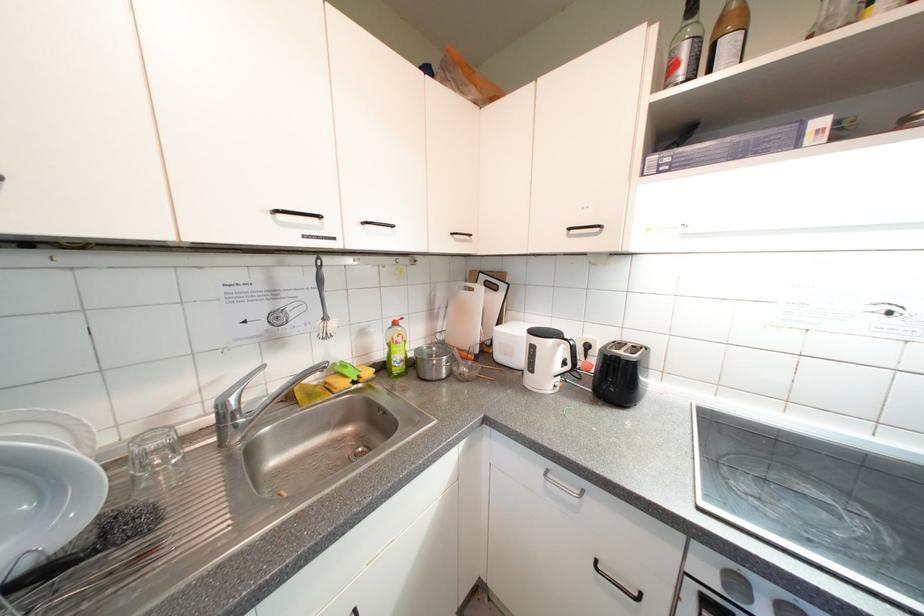
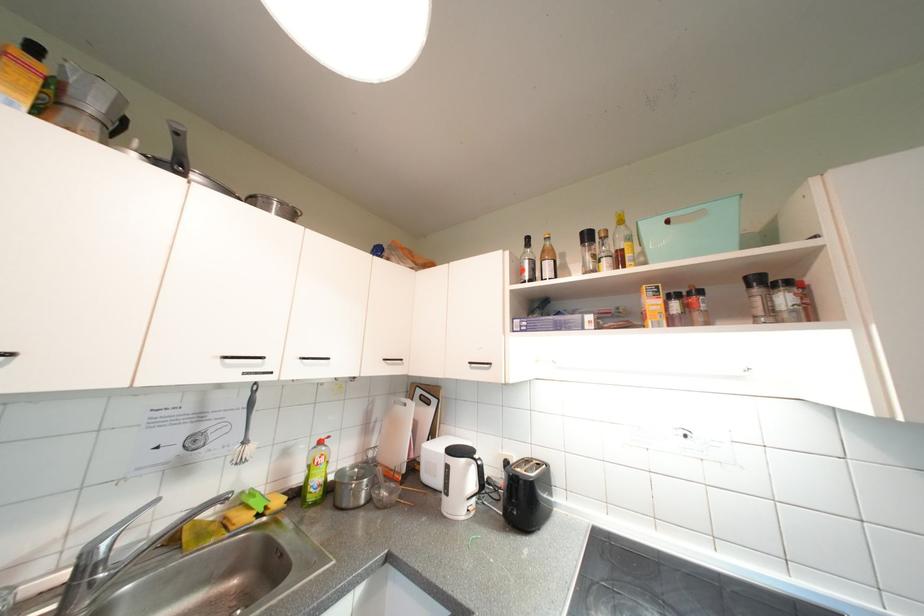
The point at (572, 353) is marked in the first image. Where is the corresponding point in the second image?

(481, 474)